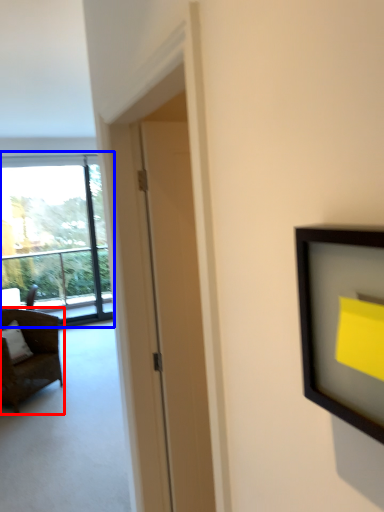
Question: Which object appears closest to the camera in this image, chair (highlighted by a red box) or window (highlighted by a blue box)?

Choices:
 (A) chair
 (B) window

Answer: (A)